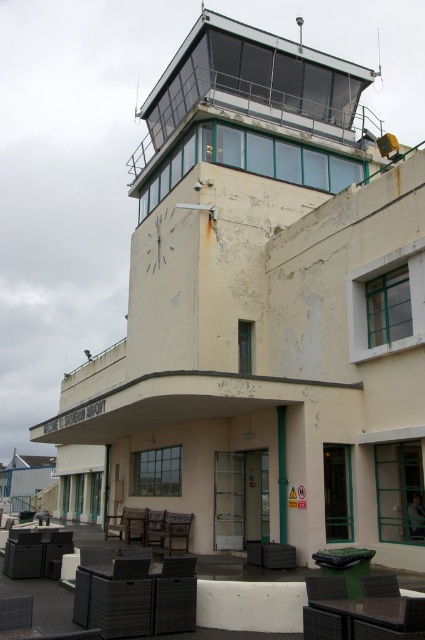
You are an airport maintenance worker needing to fit a new 1.2 meter wide storage cabinet into the control tower lobby. You see the matte black chair at lower left and the brown woven chair at lower center. Which chair has enough space next to it to accommodate the cabinet without moving other furniture?

The brown woven chair at lower center has a greater width than the matte black chair at lower left. Since the cabinet is 1.2 meters wide, the brown woven chair at lower center likely provides more space next to it for the cabinet to fit without moving other furniture.

You are an airport maintenance worker needing to place a new rectangular table that is 1.2 meters wide in the control room. The table must fit between the brown woven chair at lower center and the brown wooden chair at lower center. Can you determine if the table will fit based on their widths?

The brown woven chair at lower center is wider than the brown wooden chair at lower center. Since the table is 1.2 meters wide, you need to measure the distance between the two chairs to ensure it accommodates the table. However, the exact distance isn not provided, so you cannot determine this without further information.

You are an airport employee who needs to choose a chair for a visitor. The visitor prefers a chair that is bigger in size. Which chair should you select between the matte black chair at lower left and the brown wooden chair at lower center?

The matte black chair at lower left is larger in size than the brown wooden chair at lower center, so you should select the matte black chair at lower left.